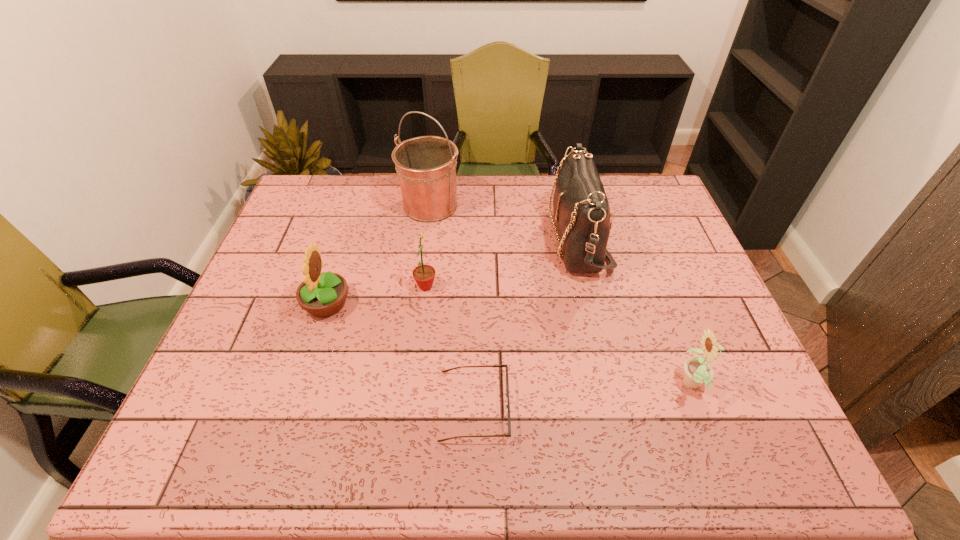
Locate an element on the screen. sunflower that is the closest one to the tallest object is located at coordinates (424, 275).

Select which sunflower appears as the closest to the second sunflower from right to left. Please provide its 2D coordinates. Your answer should be formatted as a tuple, i.e. [(x, y)], where the tuple contains the x and y coordinates of a point satisfying the conditions above.

[(324, 294)]